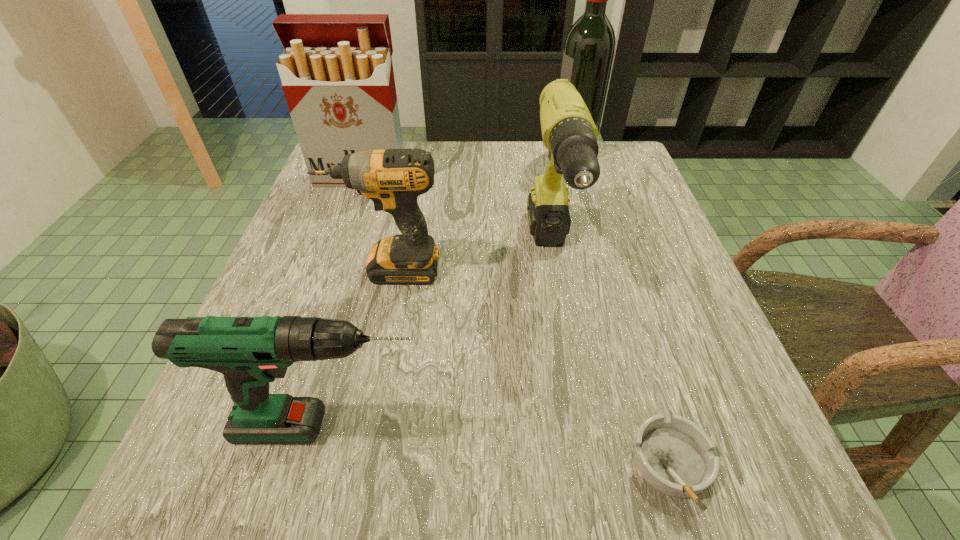
This screenshot has height=540, width=960. I want to click on free region at the far right corner, so click(602, 143).

Identify the location of blank region between the shortest object and the farthest object. (622, 308).

The width and height of the screenshot is (960, 540). What are the coordinates of `free spot between the tallest object and the ashtray` in the screenshot? It's located at (622, 308).

Locate an element on the screen. The height and width of the screenshot is (540, 960). blank region between the shortest object and the wine bottle is located at coordinates (622, 308).

Identify the location of free space between the farthest object and the cigarette case. (468, 165).

Locate an element on the screen. vacant space that is in between the wine bottle and the nearest drill is located at coordinates (452, 290).

The width and height of the screenshot is (960, 540). I want to click on blank region between the fourth object from left to right and the nearest drill, so click(x=441, y=341).

Image resolution: width=960 pixels, height=540 pixels. In order to click on empty location between the rightmost drill and the ashtray in this screenshot , I will do `click(612, 360)`.

Locate which object ranks fifth in proximity to the shortest object. Please provide its 2D coordinates. Your answer should be formatted as a tuple, i.e. [(x, y)], where the tuple contains the x and y coordinates of a point satisfying the conditions above.

[(337, 76)]

Locate which object is the closest to the tallest drill. Please provide its 2D coordinates. Your answer should be formatted as a tuple, i.e. [(x, y)], where the tuple contains the x and y coordinates of a point satisfying the conditions above.

[(393, 178)]